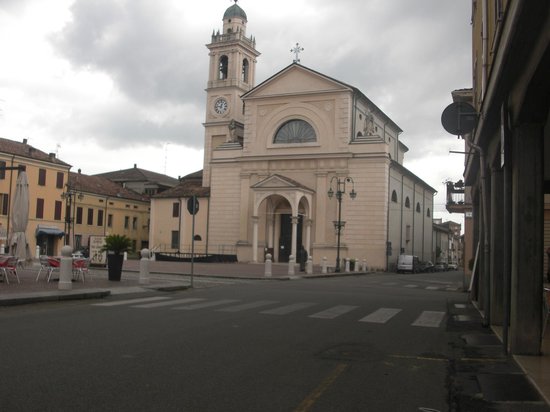
Where is `clock`? The width and height of the screenshot is (550, 412). clock is located at coordinates (216, 106).